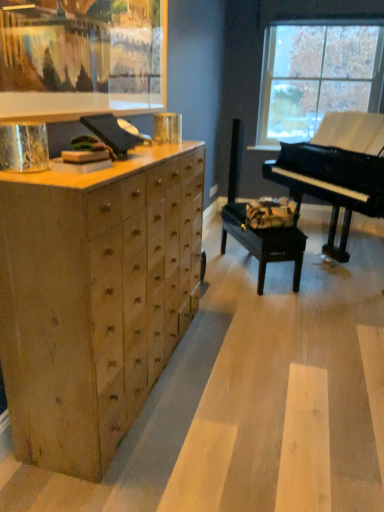
Question: From the image's perspective, does black polished piano at right appear lower than black wood music stool at center?

Choices:
 (A) no
 (B) yes

Answer: (A)

Question: Does black polished piano at right have a greater width compared to black wood music stool at center?

Choices:
 (A) yes
 (B) no

Answer: (A)

Question: Is the position of black polished piano at right more distant than that of black wood music stool at center?

Choices:
 (A) no
 (B) yes

Answer: (A)

Question: Is black polished piano at right taller than black wood music stool at center?

Choices:
 (A) no
 (B) yes

Answer: (B)

Question: Does black polished piano at right have a smaller size compared to black wood music stool at center?

Choices:
 (A) yes
 (B) no

Answer: (B)

Question: Does black polished piano at right turn towards black wood music stool at center?

Choices:
 (A) no
 (B) yes

Answer: (B)

Question: Can you confirm if transparent glass window at upper right is smaller than wooden picture frame at upper left?

Choices:
 (A) yes
 (B) no

Answer: (B)

Question: Is transparent glass window at upper right positioned beyond the bounds of wooden picture frame at upper left?

Choices:
 (A) yes
 (B) no

Answer: (A)

Question: Is transparent glass window at upper right positioned far away from wooden picture frame at upper left?

Choices:
 (A) yes
 (B) no

Answer: (A)

Question: Is wooden picture frame at upper left located within transparent glass window at upper right?

Choices:
 (A) no
 (B) yes

Answer: (A)

Question: Can you confirm if transparent glass window at upper right is wider than wooden picture frame at upper left?

Choices:
 (A) no
 (B) yes

Answer: (B)

Question: Is transparent glass window at upper right positioned before wooden picture frame at upper left?

Choices:
 (A) no
 (B) yes

Answer: (A)

Question: Is transparent glass window at upper right aimed at black wood music stool at center?

Choices:
 (A) no
 (B) yes

Answer: (B)